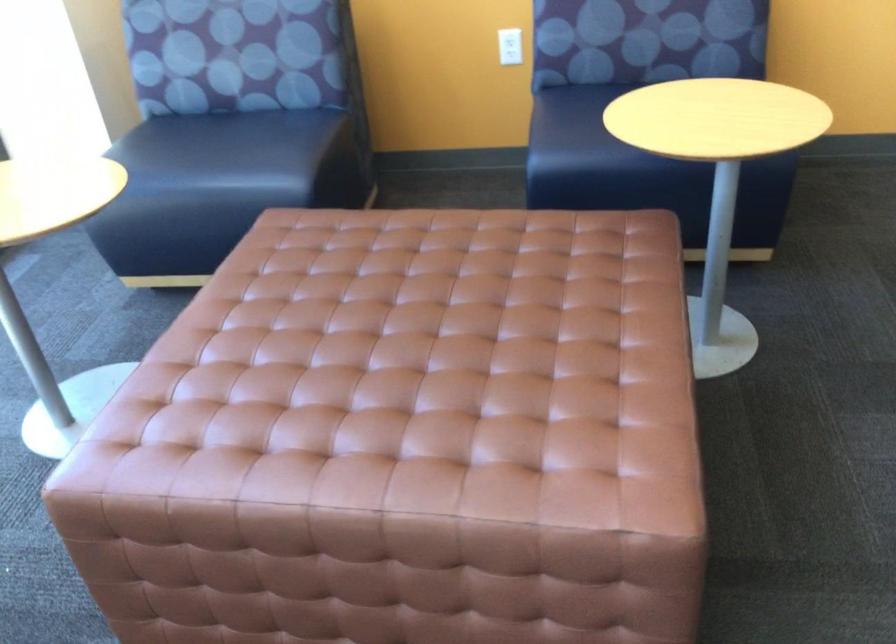
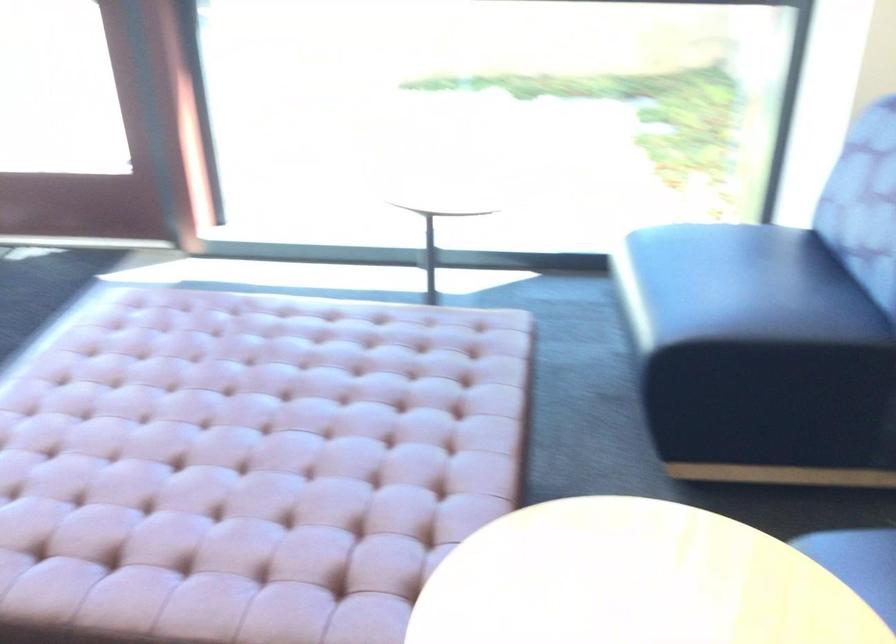
Where in the second image is the point corresponding to pixel 399 288 from the first image?

(306, 406)